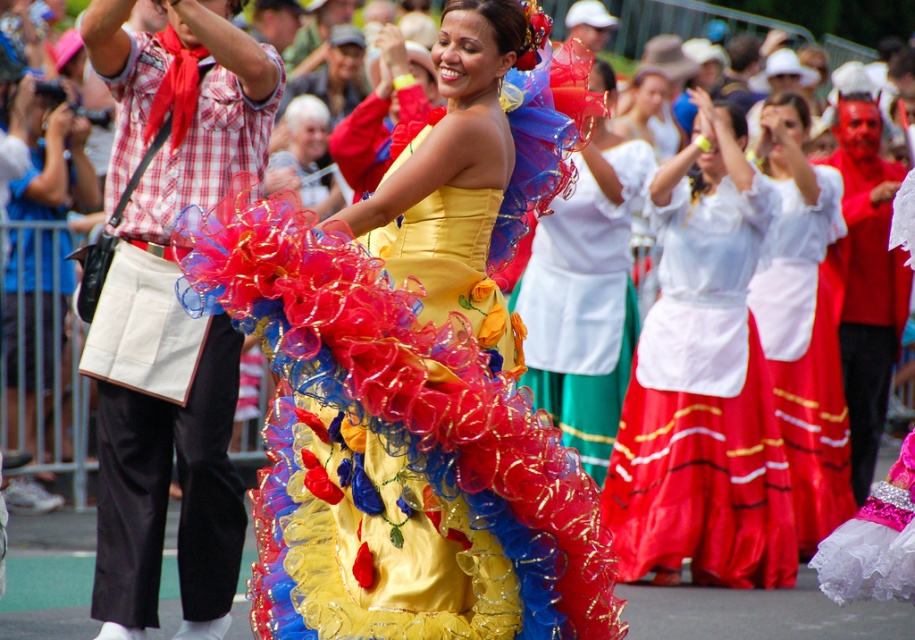
Does satin yellow dress at center appear on the right side of white satin blouse at center?

In fact, satin yellow dress at center is to the left of white satin blouse at center.

Is satin yellow dress at center smaller than white satin blouse at center?

Yes, satin yellow dress at center is smaller than white satin blouse at center.

Is point (414, 326) more distant than point (777, 468)?

No, (414, 326) is closer to viewer.

Locate an element on the screen. This screenshot has height=640, width=915. satin yellow dress at center is located at coordinates click(x=418, y=371).

Is white satin blouse at center taller than white satin blouse at upper center?

Incorrect, white satin blouse at center's height is not larger of white satin blouse at upper center's.

Is white satin blouse at center positioned at the back of white satin blouse at upper center?

No, white satin blouse at center is closer to the viewer.

Does point (716, 452) lie in front of point (782, 346)?

That is True.

The image size is (915, 640). Identify the location of white satin blouse at center. (703, 385).

Who is more distant from viewer, (x=298, y=502) or (x=614, y=218)?

The point (x=614, y=218) is more distant.

Does satin yellow dress at center have a smaller size compared to shiny tulle dress at center?

Yes, satin yellow dress at center is smaller than shiny tulle dress at center.

Who is more forward, (354, 561) or (550, 298)?

Point (354, 561)

Find the location of a particular element. The width and height of the screenshot is (915, 640). satin yellow dress at center is located at coordinates (418, 371).